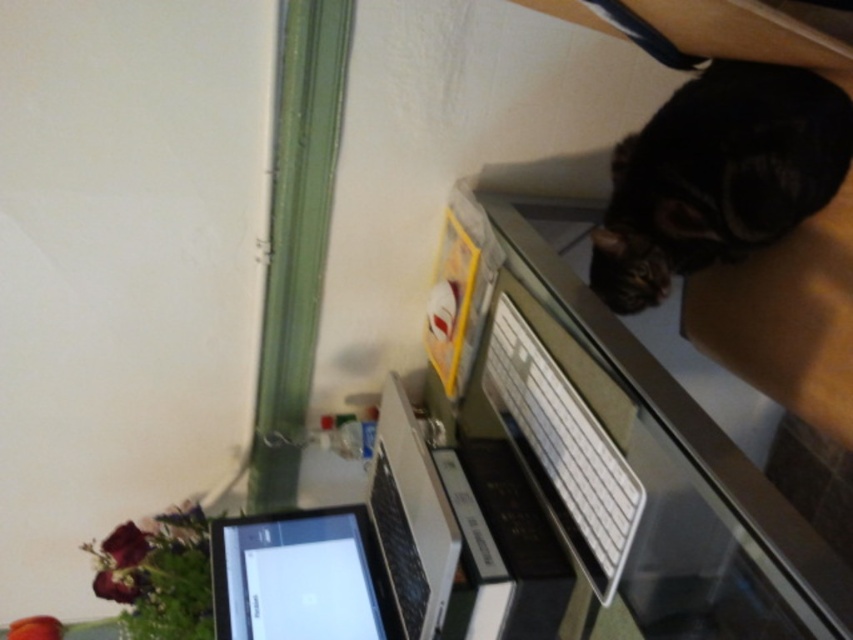
You are organizing items on the desk and need to place a new item between the black fur cat at upper right and the black glossy tablet at lower left. Which object should you place the new item closer to if you want it to be nearer to the viewer?

You should place the new item closer to the black fur cat at upper right because it is nearer to the viewer compared to the black glossy tablet at lower left.

Consider the image. You are standing at the point marked as point (364, 618) and want to take a photo of the desk setup. The camera you are holding is 1.30 meters away from you. Is the camera close enough to capture the entire desk area in one shot?

The camera is 1.30 meters away from point (364, 618), which is the location where you are standing. Since the desk is cluttered with items like a laptop, flowers, books, and a cat, the distance of 1.30 meters should allow the camera to capture the entire desk area in one shot.

You are a delivery robot trying to place a package on the desk. The package must be placed at the exact coordinates of the satin black laptop at lower left. What are the coordinates where you should place the package?

The coordinates for the satin black laptop at lower left are at point (345, 552). You should place the package at those coordinates.